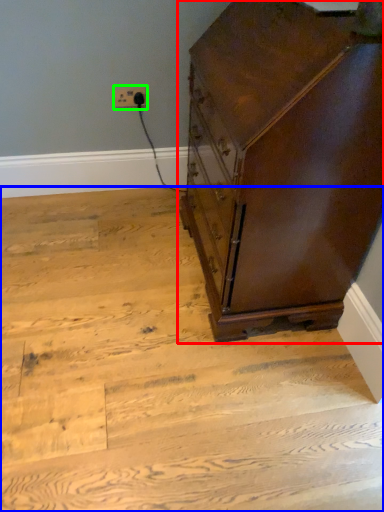
Question: Estimate the real-world distances between objects in this image. Which object is closer to chest of drawers (highlighted by a red box), stairwell (highlighted by a blue box) or electric outlet (highlighted by a green box)?

Choices:
 (A) stairwell
 (B) electric outlet

Answer: (A)